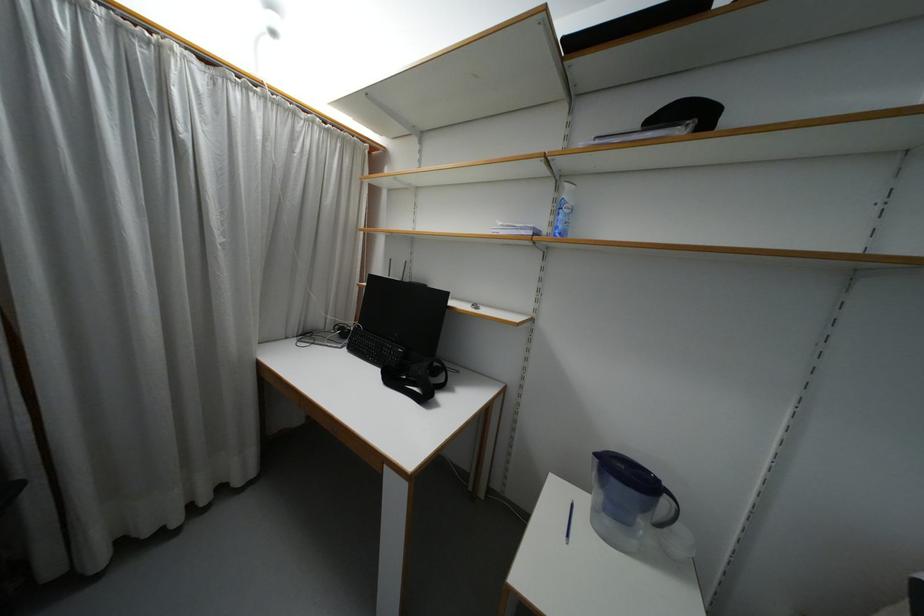
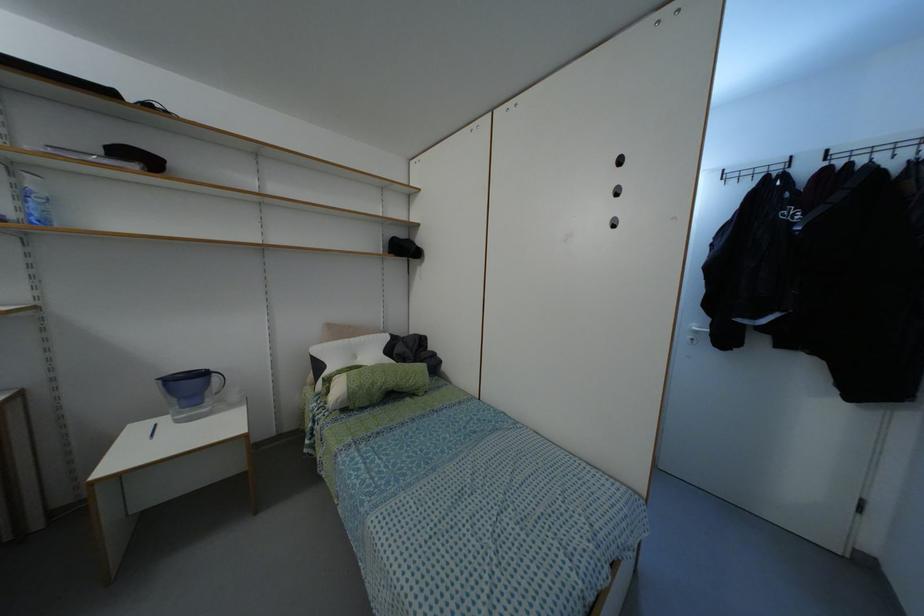
In the second image, find the point that corresponds to pixel 663 501 in the first image.

(214, 378)